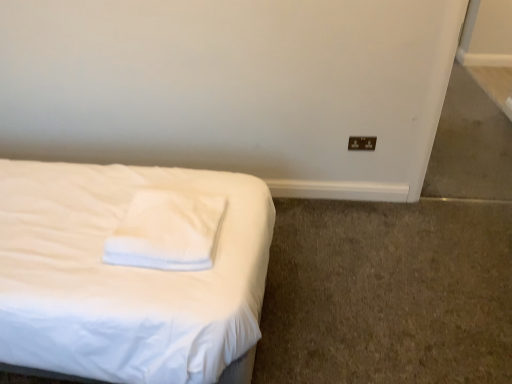
Question: From a real-world perspective, is white soft pillow at center above or below black plastic electric outlet at upper right?

Choices:
 (A) below
 (B) above

Answer: (B)

Question: Is point (159, 216) positioned closer to the camera than point (364, 145)?

Choices:
 (A) closer
 (B) farther

Answer: (A)

Question: Considering the relative positions of white soft pillow at center and black plastic electric outlet at upper right in the image provided, is white soft pillow at center to the left or to the right of black plastic electric outlet at upper right?

Choices:
 (A) right
 (B) left

Answer: (B)

Question: Is point (356, 142) positioned closer to the camera than point (133, 249)?

Choices:
 (A) farther
 (B) closer

Answer: (A)

Question: Considering the relative positions of black plastic electric outlet at upper right and white soft pillow at center in the image provided, is black plastic electric outlet at upper right to the left or to the right of white soft pillow at center?

Choices:
 (A) left
 (B) right

Answer: (B)

Question: Considering the positions of black plastic electric outlet at upper right and white soft pillow at center in the image, is black plastic electric outlet at upper right bigger or smaller than white soft pillow at center?

Choices:
 (A) big
 (B) small

Answer: (B)

Question: From a real-world perspective, is black plastic electric outlet at upper right positioned above or below white soft pillow at center?

Choices:
 (A) above
 (B) below

Answer: (B)